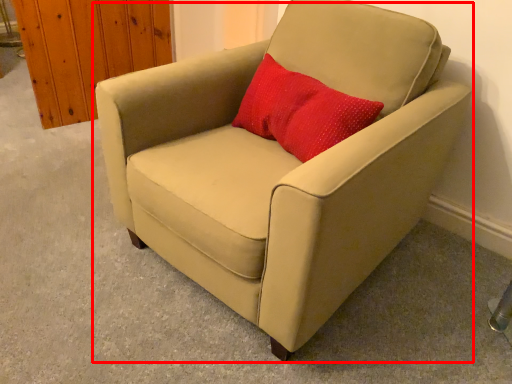
Question: Considering the relative positions of chair (annotated by the red box) and throw pillow in the image provided, where is chair (annotated by the red box) located with respect to the staircase?

Choices:
 (A) right
 (B) left

Answer: (B)